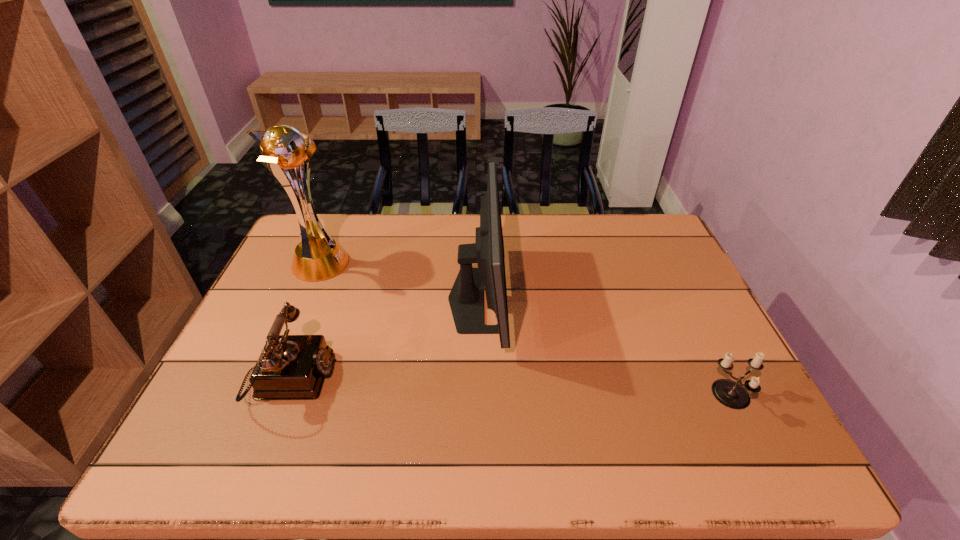
Locate an element on the screen. The height and width of the screenshot is (540, 960). vacant space at the near left corner of the desktop is located at coordinates (239, 468).

This screenshot has height=540, width=960. In the image, there is a desktop. Find the location of `vacant space at the far right corner`. vacant space at the far right corner is located at coordinates (636, 219).

What are the coordinates of `vacant area that lies between the computer monitor and the shortest object` in the screenshot? It's located at (605, 347).

Identify the location of vacant space in between the candle holder and the third object from left to right. This screenshot has width=960, height=540. (605, 347).

Identify the location of empty space that is in between the candle holder and the tallest object. This screenshot has height=540, width=960. (525, 330).

Where is `free space between the candle holder and the second tallest object`? free space between the candle holder and the second tallest object is located at coordinates (605, 347).

This screenshot has width=960, height=540. I want to click on free spot between the second tallest object and the shortest object, so click(605, 347).

At what (x,y) coordinates should I click in order to perform the action: click on free space between the shortest object and the telephone. Please return your answer as a coordinate pair (x, y). The height and width of the screenshot is (540, 960). Looking at the image, I should click on (511, 388).

Locate an element on the screen. free space that is in between the tallest object and the shortest object is located at coordinates (525, 330).

The height and width of the screenshot is (540, 960). What are the coordinates of `free spot between the candle holder and the computer monitor` in the screenshot? It's located at (605, 347).